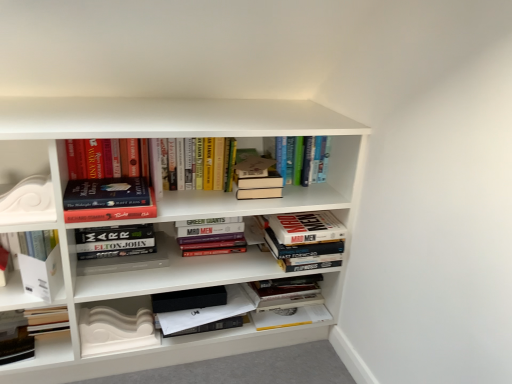
Where is `vacant point above white matte decorative piece at lower left, which is the first paperback book from bottom to top (from a real-world perspective)`? This screenshot has width=512, height=384. vacant point above white matte decorative piece at lower left, which is the first paperback book from bottom to top (from a real-world perspective) is located at coordinates pyautogui.click(x=113, y=302).